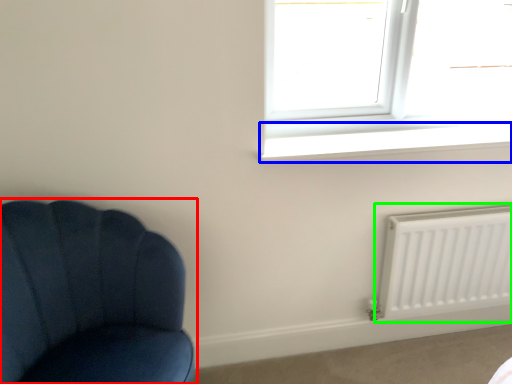
Question: Which object is the farthest from chair (highlighted by a red box)? Choose among these: window sill (highlighted by a blue box) or radiator (highlighted by a green box).

Choices:
 (A) window sill
 (B) radiator

Answer: (B)